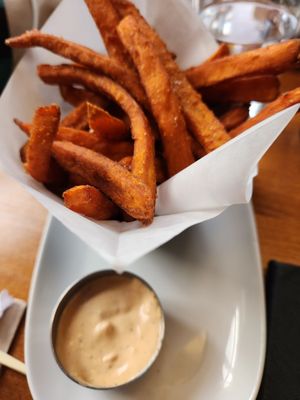
You are a GUI agent. You are given a task and a screenshot of the screen. Output one action in this format:
    pyautogui.click(x=<x>, y=<y>)
    Task: Click on the napkin
    The height and width of the screenshot is (400, 300).
    Given the screenshot: What is the action you would take?
    pyautogui.click(x=271, y=295)